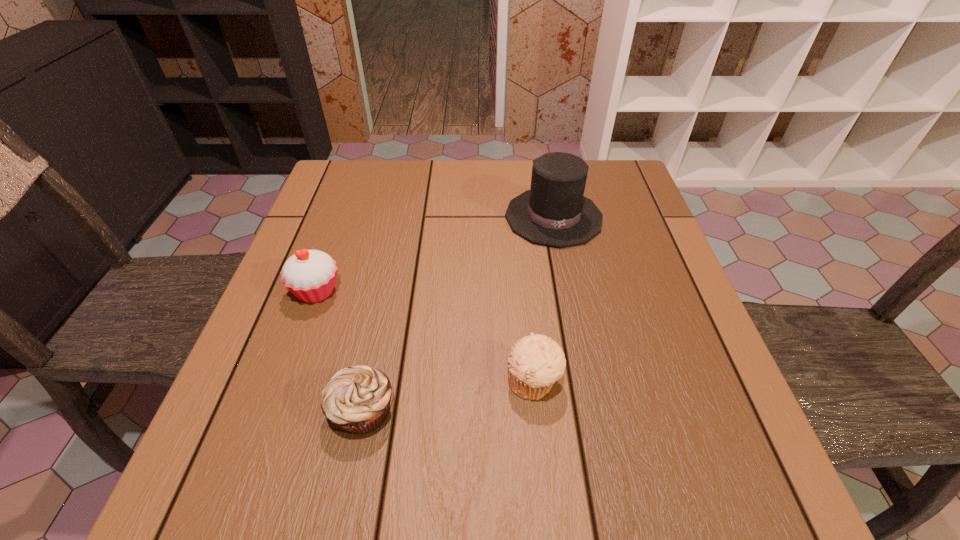
In the image, there is a desktop. At what (x,y) coordinates should I click in order to perform the action: click on free region at the far right corner. Please return your answer as a coordinate pair (x, y). Looking at the image, I should click on (636, 185).

I want to click on free spot between the second tallest object and the left muffin, so click(340, 351).

Where is `vacant area between the second object from left to right and the right muffin`? vacant area between the second object from left to right and the right muffin is located at coordinates (448, 396).

Locate an element on the screen. This screenshot has height=540, width=960. vacant space that's between the right muffin and the leftmost object is located at coordinates (425, 336).

Find the location of a particular element. Image resolution: width=960 pixels, height=540 pixels. vacant space in between the farthest object and the right muffin is located at coordinates (543, 299).

Locate an element on the screen. vacant space in between the right muffin and the third nearest object is located at coordinates (425, 336).

Locate an element on the screen. free space between the right muffin and the leftmost object is located at coordinates (425, 336).

In order to click on empty location between the third nearest object and the tallest object in this screenshot , I will do `click(435, 254)`.

Where is `vacant point located between the right muffin and the dress hat`? vacant point located between the right muffin and the dress hat is located at coordinates (543, 299).

Where is `empty space that is in between the third object from right to left and the third nearest object`? This screenshot has height=540, width=960. empty space that is in between the third object from right to left and the third nearest object is located at coordinates (340, 351).